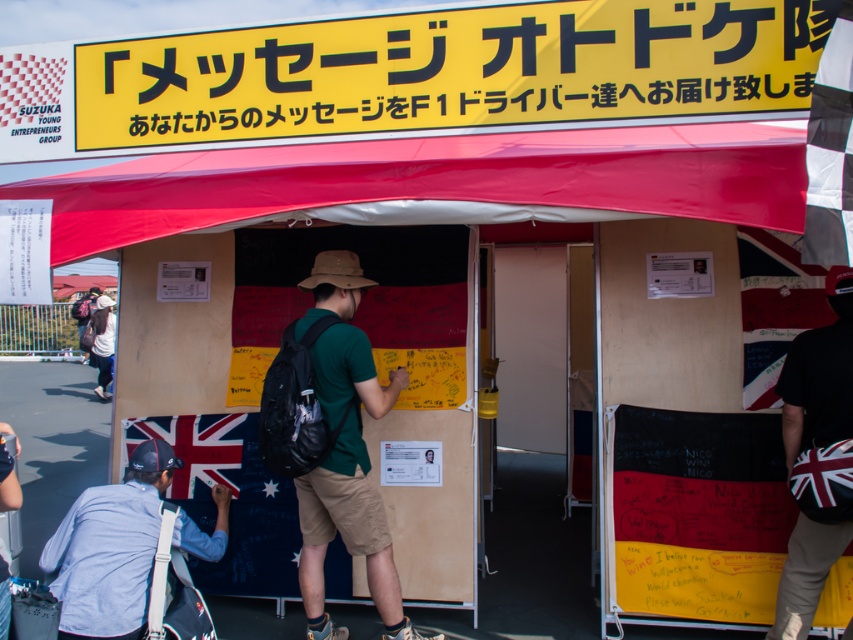
Question: Which object is closer to the camera taking this photo?

Choices:
 (A) green matte shirt at center
 (B) british flag-patterned fanny pack at center

Answer: (B)

Question: Considering the relative positions of wooden bulletin board at center and green matte shirt at center in the image provided, where is wooden bulletin board at center located with respect to green matte shirt at center?

Choices:
 (A) right
 (B) left

Answer: (B)

Question: Can you confirm if red fabric canopy at upper center is wider than white shirt at lower left?

Choices:
 (A) yes
 (B) no

Answer: (A)

Question: Which object is farther from the camera taking this photo?

Choices:
 (A) british flag-patterned fanny pack at center
 (B) wooden bulletin board at center
 (C) checkered fabric flag at upper right
 (D) green matte shirt at center

Answer: (B)

Question: Is the position of red fabric canopy at upper center more distant than that of green matte shirt at center?

Choices:
 (A) yes
 (B) no

Answer: (B)

Question: Estimate the real-world distances between objects in this image. Which object is farther from the checkered fabric flag at upper right?

Choices:
 (A) white shirt at lower left
 (B) green matte shirt at center
 (C) british flag-patterned fanny pack at center

Answer: (A)